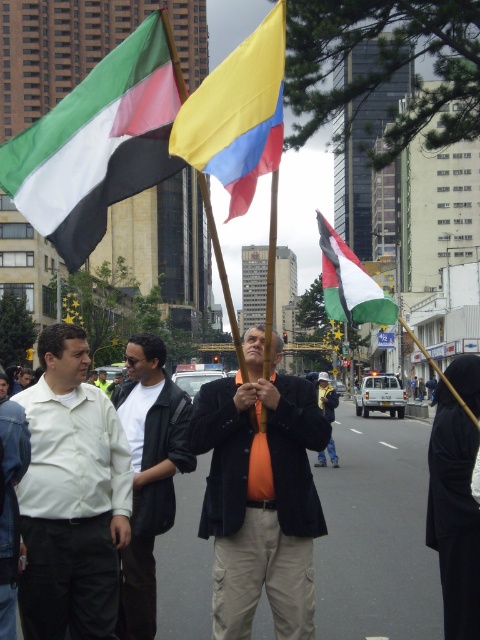
Based on the scene description, what is located at the coordinates point (260, 493)?

The orange fabric shirt at center is located at point (260, 493).

You are a photographer standing at the center of the street. You want to take a photo that includes both the point at coordinates point (265, 528) and point (321, 401). Given that you can only focus on one point at a time, which point should you focus on to ensure the other point remains in focus?

You should focus on point 0.627, 0669 because it is farther away, ensuring that the closer point (265, 528) will also be in focus due to the depth of field extending backward from the focused point.